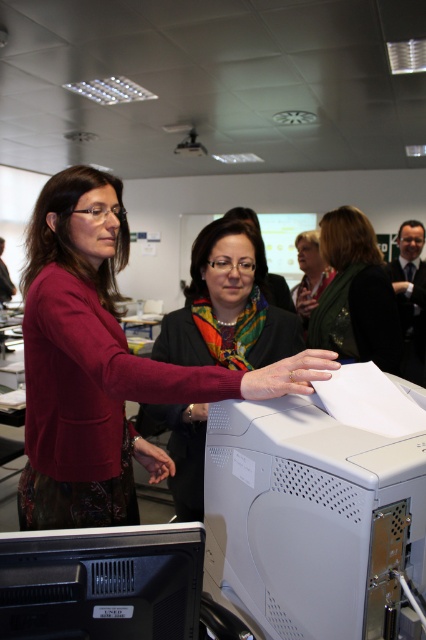
Question: Does green textured scarf at center appear on the left side of multicolored scarf at center?

Choices:
 (A) yes
 (B) no

Answer: (A)

Question: Which object appears closest to the camera in this image?

Choices:
 (A) green textured scarf at center
 (B) white plastic printer at center

Answer: (B)

Question: Where is black plastic computer monitor at lower left located in relation to green textured scarf at center in the image?

Choices:
 (A) below
 (B) above

Answer: (A)

Question: Among these objects, which one is nearest to the camera?

Choices:
 (A) matte black sweater at center
 (B) multicolored scarf at center
 (C) black plastic computer monitor at lower left
 (D) green textured scarf at center

Answer: (C)

Question: Can you confirm if white plastic printer at center is positioned above matte red jacket at center?

Choices:
 (A) no
 (B) yes

Answer: (A)

Question: Among these points, which one is nearest to the camera?

Choices:
 (A) (239, 275)
 (B) (74, 433)

Answer: (B)